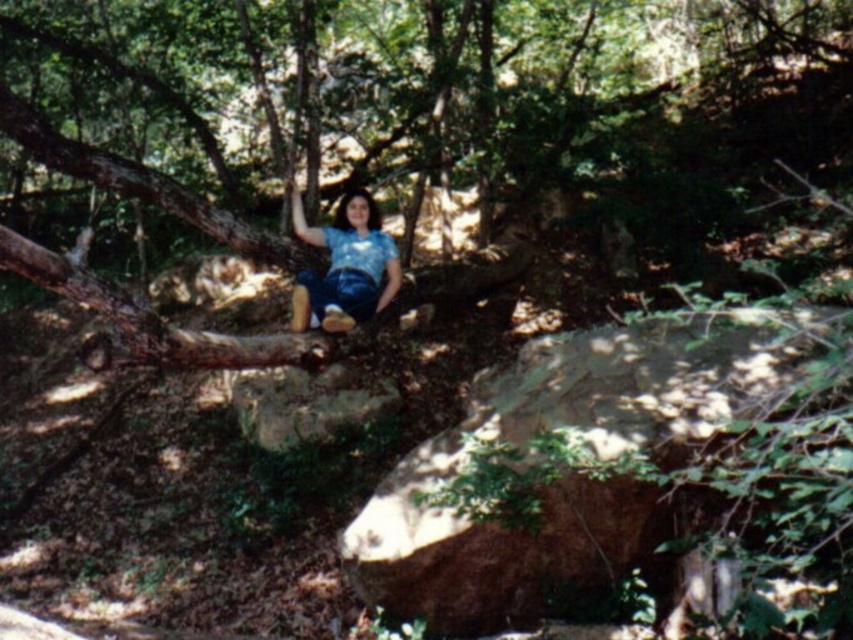
Question: Is brown rough rock at lower center bigger than brown rough tree trunk at left?

Choices:
 (A) no
 (B) yes

Answer: (B)

Question: Among these objects, which one is farthest from the camera?

Choices:
 (A) brown rough rock at lower center
 (B) blue denim jeans at center

Answer: (B)

Question: Which object is closer to the camera taking this photo?

Choices:
 (A) brown rough rock at lower center
 (B) blue denim jeans at center

Answer: (A)

Question: Does brown rough rock at lower center appear over blue denim jeans at center?

Choices:
 (A) no
 (B) yes

Answer: (A)

Question: Is brown rough rock at lower center above blue denim jeans at center?

Choices:
 (A) yes
 (B) no

Answer: (B)

Question: Which object is positioned farthest from the brown rough rock at lower center?

Choices:
 (A) blue denim jeans at center
 (B) brown rough tree trunk at left

Answer: (B)